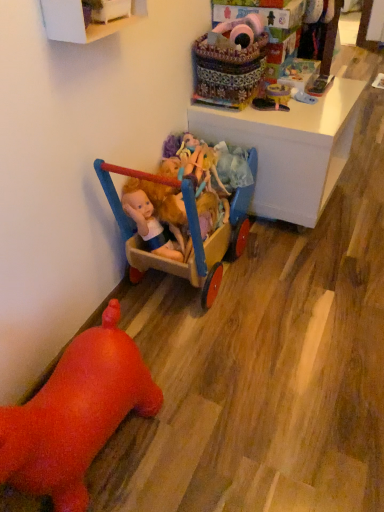
Question: Can you confirm if matte plastic toy at upper center, which is the 5th toy from bottom to top, is positioned to the right of white glossy desk at upper center?

Choices:
 (A) no
 (B) yes

Answer: (A)

Question: Can you confirm if matte plastic toy at upper center, which is the 5th toy from bottom to top, is thinner than white glossy desk at upper center?

Choices:
 (A) yes
 (B) no

Answer: (A)

Question: Could you tell me if matte plastic toy at upper center, which is the 5th toy from bottom to top, is facing white glossy desk at upper center?

Choices:
 (A) yes
 (B) no

Answer: (B)

Question: Does matte plastic toy at upper center, which is the 5th toy from bottom to top, have a smaller size compared to white glossy desk at upper center?

Choices:
 (A) yes
 (B) no

Answer: (A)

Question: From a real-world perspective, does matte plastic toy at upper center, which appears as the second toy when viewed from the top, sit lower than white glossy desk at upper center?

Choices:
 (A) no
 (B) yes

Answer: (A)

Question: Is matte plastic toy at upper center, which is the 5th toy from bottom to top, situated inside matte plastic doll at center, acting as the 4th toy starting from the top, or outside?

Choices:
 (A) inside
 (B) outside

Answer: (B)

Question: From their relative heights in the image, would you say matte plastic toy at upper center, which appears as the second toy when viewed from the top, is taller or shorter than matte plastic doll at center, acting as the 4th toy starting from the top?

Choices:
 (A) tall
 (B) short

Answer: (B)

Question: In the image, is matte plastic toy at upper center, which appears as the second toy when viewed from the top, positioned in front of or behind matte plastic doll at center, the 3th toy when ordered from bottom to top?

Choices:
 (A) front
 (B) behind

Answer: (B)

Question: Is matte plastic toy at upper center, which appears as the second toy when viewed from the top, bigger or smaller than matte plastic doll at center, acting as the 4th toy starting from the top?

Choices:
 (A) small
 (B) big

Answer: (A)

Question: In the image, is matte plastic toy at upper center, which appears as the second toy when viewed from the top, positioned in front of or behind black rubber shoe at upper right, which is the 4th toy from bottom to top?

Choices:
 (A) behind
 (B) front

Answer: (A)

Question: Considering the positions of matte plastic toy at upper center, which is the 5th toy from bottom to top, and black rubber shoe at upper right, acting as the third toy starting from the top, in the image, is matte plastic toy at upper center, which is the 5th toy from bottom to top, taller or shorter than black rubber shoe at upper right, acting as the third toy starting from the top,?

Choices:
 (A) tall
 (B) short

Answer: (A)

Question: Is point 269,94 closer or farther from the camera than point 286,104?

Choices:
 (A) farther
 (B) closer

Answer: (A)

Question: From the image's perspective, relative to black rubber shoe at upper right, which is the 4th toy from bottom to top, is matte plastic toy at upper center, which is the 5th toy from bottom to top, above or below?

Choices:
 (A) below
 (B) above

Answer: (B)

Question: Is rubber duck at lower left, which is the first toy in bottom-to-top order, wider or thinner than brightly colored fabric basket at upper center?

Choices:
 (A) wide
 (B) thin

Answer: (A)

Question: Is point (66, 506) closer or farther from the camera than point (218, 54)?

Choices:
 (A) farther
 (B) closer

Answer: (B)